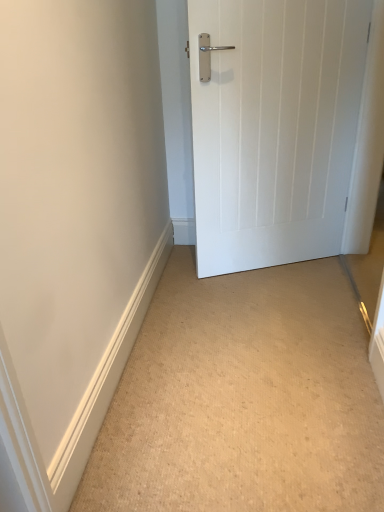
Where is `vacant area to the left of white wooden door at right`? vacant area to the left of white wooden door at right is located at coordinates [x=192, y=285].